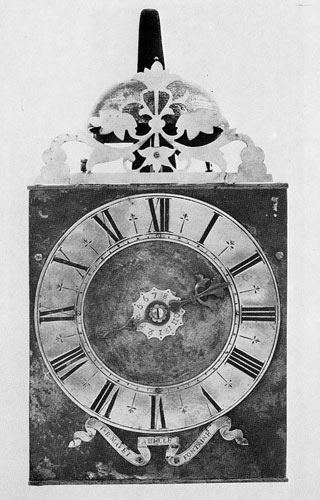
At what (x,y) coordinates should I click in order to perform the action: click on face of clock. Please return your answer as a coordinate pair (x, y). Looking at the image, I should click on (125, 277).